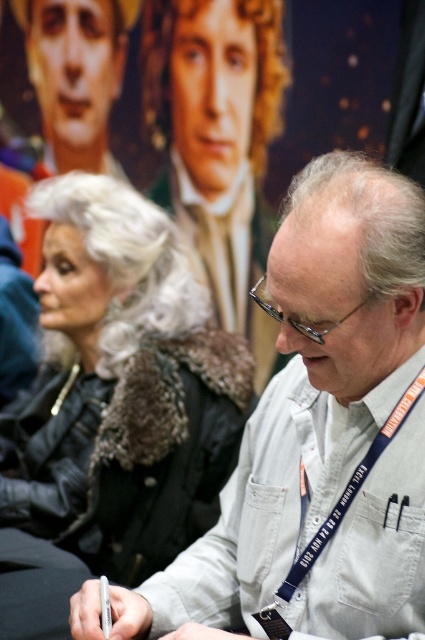
Does white cotton shirt at center have a greater height compared to smooth silver hair at upper center?

Correct, white cotton shirt at center is much taller as smooth silver hair at upper center.

How far apart are white cotton shirt at center and smooth silver hair at upper center?

The distance of white cotton shirt at center from smooth silver hair at upper center is 1.77 meters.

Who is more forward, (348, 529) or (62, 36)?

Point (348, 529)

Where is `white cotton shirt at center`? The image size is (425, 640). white cotton shirt at center is located at coordinates (320, 433).

From the picture: Who is more distant from viewer, (343, 596) or (88, 506)?

The point (88, 506) is behind.

Between white cotton shirt at center and black leather jacket at center, which one has more height?

black leather jacket at center

The width and height of the screenshot is (425, 640). In order to click on white cotton shirt at center in this screenshot , I will do `click(320, 433)`.

Based on the photo, is white textured shirt at center bigger than smooth silver hair at upper center?

Yes.

What do you see at coordinates (218, 138) in the screenshot? The height and width of the screenshot is (640, 425). I see `white textured shirt at center` at bounding box center [218, 138].

Image resolution: width=425 pixels, height=640 pixels. I want to click on white textured shirt at center, so click(218, 138).